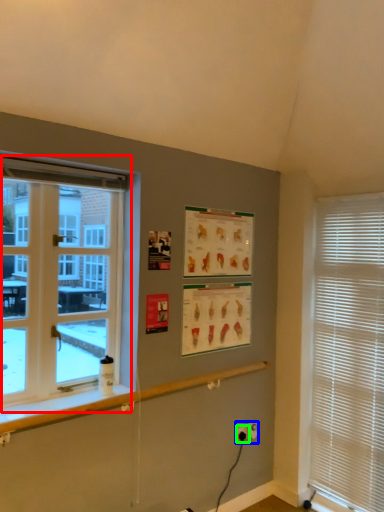
Question: Which object is positioned closest to window (highlighted by a red box)? Select from electric outlet (highlighted by a blue box) and electric outlet (highlighted by a green box).

Choices:
 (A) electric outlet
 (B) electric outlet

Answer: (A)